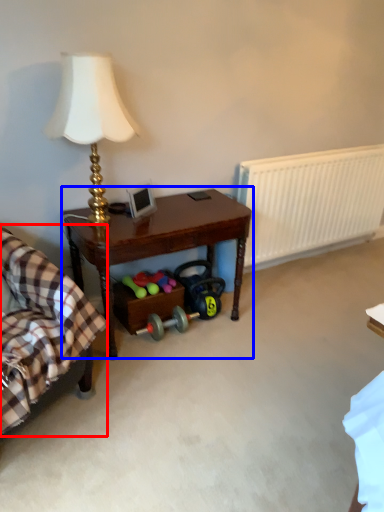
Question: Which object appears farthest to the camera in this image, rocking chair (highlighted by a red box) or table (highlighted by a blue box)?

Choices:
 (A) rocking chair
 (B) table

Answer: (B)